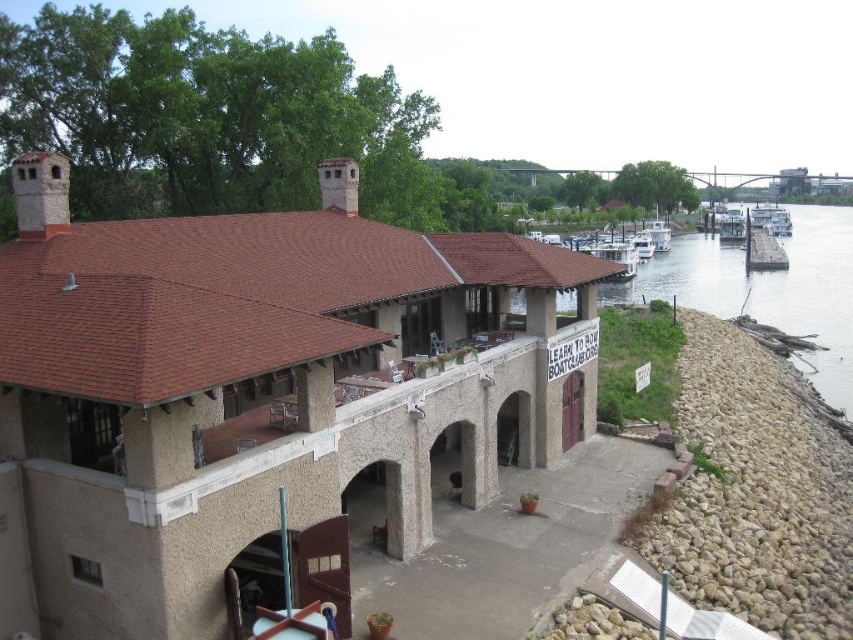
The width and height of the screenshot is (853, 640). Identify the location of white wooden boat at center. (659, 236).

Image resolution: width=853 pixels, height=640 pixels. Describe the element at coordinates (659, 236) in the screenshot. I see `white wooden boat at center` at that location.

What are the coordinates of `white wooden boat at center` in the screenshot? It's located at tap(659, 236).

Describe the element at coordinates (753, 492) in the screenshot. I see `rocky embankment at lower right` at that location.

Does rocky embankment at lower right have a lesser width compared to white wooden boat at center?

No, rocky embankment at lower right is not thinner than white wooden boat at center.

Who is more forward, (746, 556) or (654, 220)?

Point (746, 556)

The image size is (853, 640). I want to click on rocky embankment at lower right, so click(753, 492).

Is rocky embankment at lower right positioned in front of smooth concrete water at right?

Yes, it is in front of smooth concrete water at right.

Between rocky embankment at lower right and smooth concrete water at right, which one appears on the right side from the viewer's perspective?

From the viewer's perspective, smooth concrete water at right appears more on the right side.

Who is more forward, [683,408] or [635,276]?

Point [683,408]

What are the coordinates of `rocky embankment at lower right` in the screenshot? It's located at (753, 492).